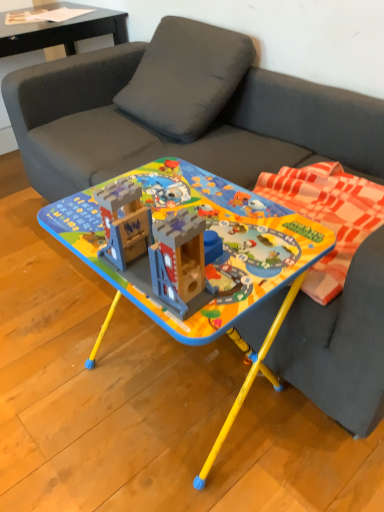
At what (x,y) coordinates should I click in order to perform the action: click on vacant area on top of matte plastic table at center, marked as the second table in a back-to-front arrangement (from a real-world perspective). Please return your answer as a coordinate pair (x, y). Looking at the image, I should click on (188, 201).